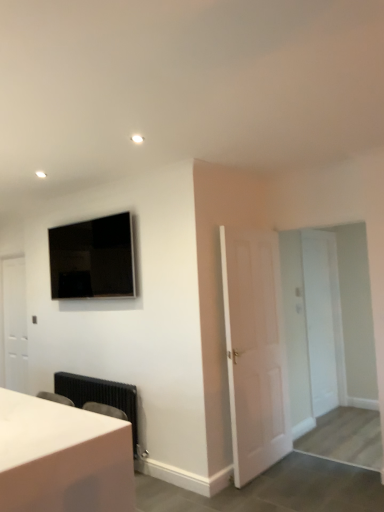
Question: Considering the positions of white matte door at left, arranged as the 3th door when viewed from the front, and white glossy table at lower left in the image, is white matte door at left, arranged as the 3th door when viewed from the front, taller or shorter than white glossy table at lower left?

Choices:
 (A) tall
 (B) short

Answer: (A)

Question: Based on their positions, is white matte door at left, placed as the 3th door when sorted from right to left, located to the left or right of white glossy table at lower left?

Choices:
 (A) left
 (B) right

Answer: (A)

Question: Which of these objects is positioned closest to the white matte door at left, which ranks as the first door in back-to-front order?

Choices:
 (A) black textured radiator at lower left
 (B) white glossy table at lower left
 (C) white matte door at center, marked as the 2th door in a back-to-front arrangement
 (D) white matte door at center, marked as the first door in a front-to-back arrangement
 (E) flat screen tv at upper left

Answer: (E)

Question: Which of these objects is positioned farthest from the white matte door at center, the 2th door viewed from the left?

Choices:
 (A) white matte door at center, acting as the 2th door starting from the front
 (B) black textured radiator at lower left
 (C) flat screen tv at upper left
 (D) white matte door at left, which is the first door from left to right
 (E) white glossy table at lower left

Answer: (D)